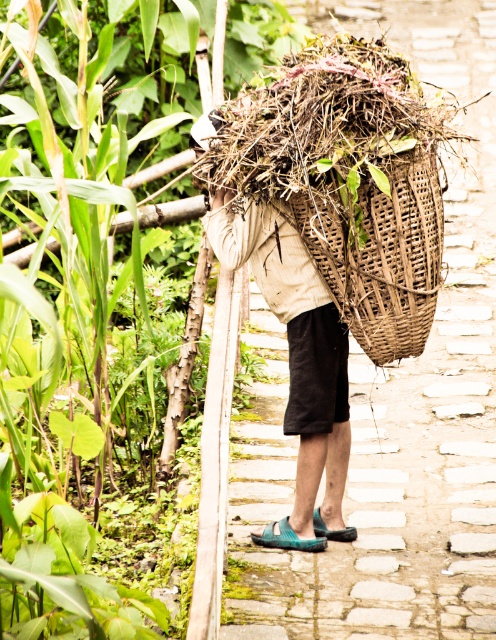
Looking at this image, you are standing at the point labeled as point (392, 467). Which object are you touching?

You are touching the brown woven basket at center because the point (392, 467) is on it.

You are standing on the cobblestone path in the rural area and see the brown woven basket at center and the woven brown basket at upper center. Which basket is closer to you?

The brown woven basket at center is closer to you than the woven brown basket at upper center since it is only 11.18 feet away from the latter.